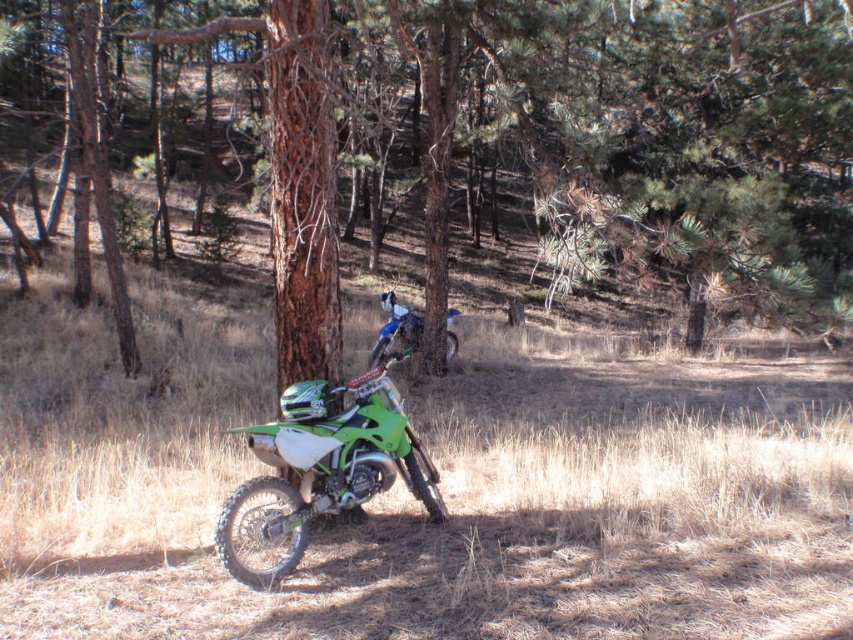
You are a photographer standing at the edge of a forest. You want to capture both the green matte dirt bike at center and the green matte motorbike at center in a single wide shot. Given that your camera has a maximum focus range of 20 feet, will both bikes be in focus?

The green matte dirt bike at center is 25.31 feet away from the green matte motorbike at center. Since the distance between them exceeds the camera maximum focus range of 20 feet, both bikes cannot be in focus simultaneously in a single wide shot.

You are standing at the origin point in the forest scene with two dirt bikes. There are two points marked in the image. Which point is closer to you, point (561, 0) or point (403, 339)?

Point (561, 0) is in front of point (403, 339), so it is closer to you.

Looking at this image, you are planning to transport both the green matte motorbike at center and the blue metallic motorcycle at center in a truck that can only accommodate one motorcycle at a time. Based on their widths, which one should you load first to ensure both fit?

The green matte motorbike at center has a larger width than the blue metallic motorcycle at center. Therefore, you should load the green matte motorbike at center first to ensure both fit in the truck.